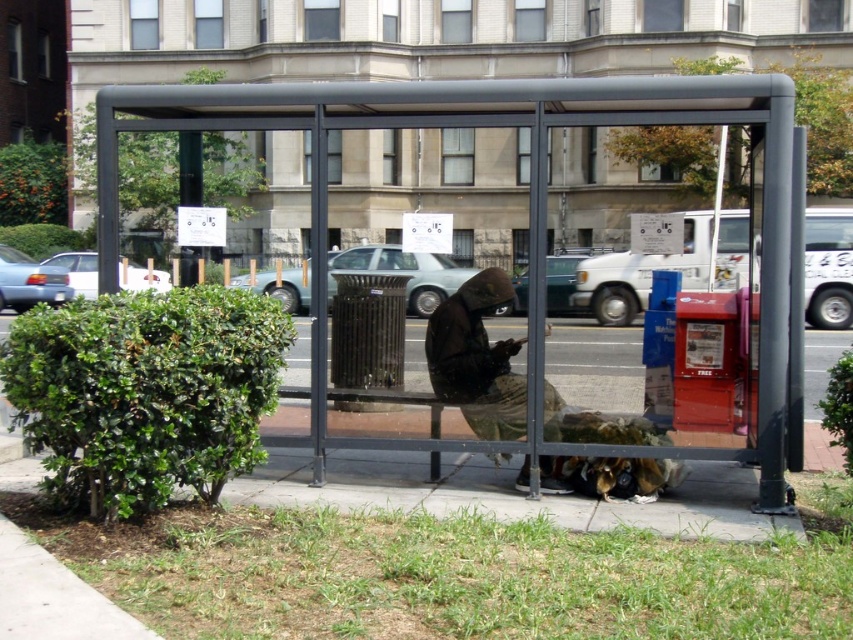
Question: Observing the image, what is the correct spatial positioning of matte black bus stop at center in reference to camouflage fabric jacket at center?

Choices:
 (A) above
 (B) below

Answer: (A)

Question: Among these points, which one is nearest to the camera?

Choices:
 (A) (471, 369)
 (B) (241, 84)

Answer: (B)

Question: Is matte black bus stop at center positioned behind camouflage fabric jacket at center?

Choices:
 (A) no
 (B) yes

Answer: (A)

Question: Among these objects, which one is farthest from the camera?

Choices:
 (A) matte black bus stop at center
 (B) camouflage fabric jacket at center

Answer: (B)

Question: Which object is farther from the camera taking this photo?

Choices:
 (A) camouflage fabric jacket at center
 (B) matte black bus stop at center

Answer: (A)

Question: Does matte black bus stop at center appear on the left side of camouflage fabric jacket at center?

Choices:
 (A) yes
 (B) no

Answer: (A)